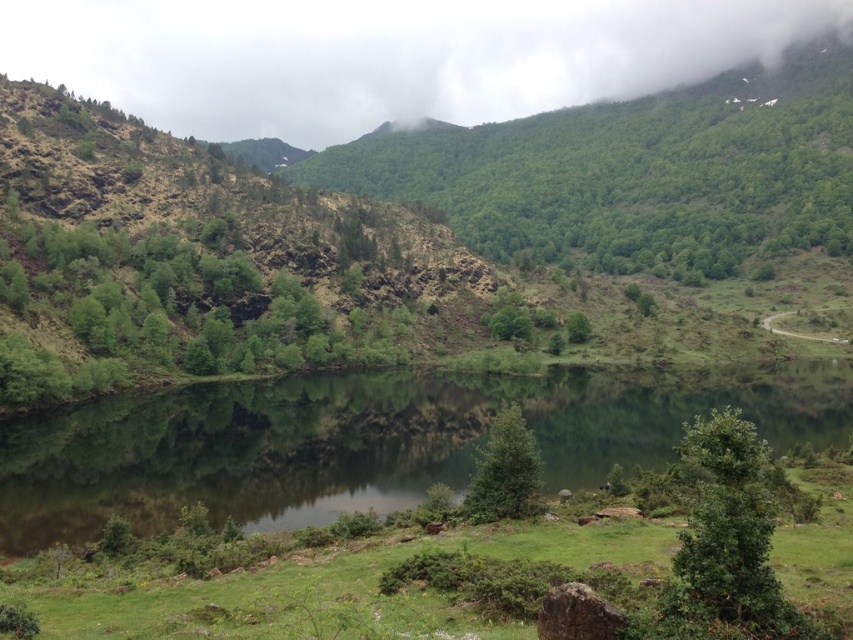
Can you confirm if green reflective water at center is positioned to the left of cloudy sky at upper center?

In fact, green reflective water at center is to the right of cloudy sky at upper center.

The image size is (853, 640). What do you see at coordinates (367, 442) in the screenshot? I see `green reflective water at center` at bounding box center [367, 442].

Where is `green reflective water at center`? Image resolution: width=853 pixels, height=640 pixels. green reflective water at center is located at coordinates (367, 442).

Who is more distant from viewer, (651,4) or (474,506)?

The point (651,4) is behind.

Can you confirm if cloudy sky at upper center is taller than green matte tree at center?

Correct, cloudy sky at upper center is much taller as green matte tree at center.

Is point (135, 65) positioned before point (490, 500)?

No, (135, 65) is further to viewer.

I want to click on cloudy sky at upper center, so click(x=386, y=56).

Is point (251, 97) closer to viewer compared to point (573, 314)?

No, it is not.

Is point (770, 1) positioned after point (573, 337)?

Yes, point (770, 1) is farther from viewer.

Identify the location of cloudy sky at upper center. Image resolution: width=853 pixels, height=640 pixels. tap(386, 56).